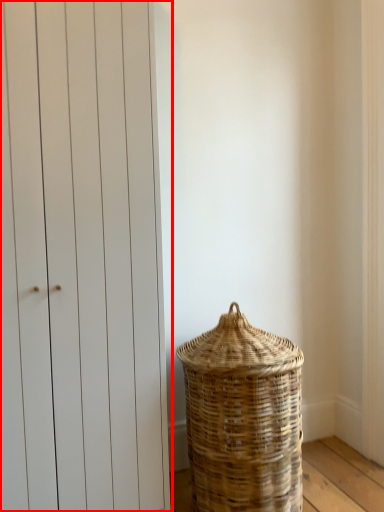
Question: From the image, what is the correct spatial relationship of door (annotated by the red box) in relation to basket?

Choices:
 (A) right
 (B) left

Answer: (B)